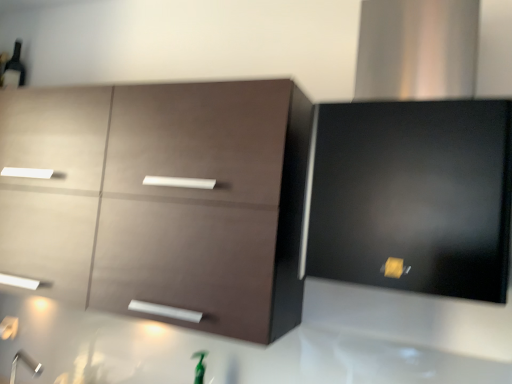
Question: Is satin black range hood at upper right, the 2th cabinetry in the left-to-right sequence, wider or thinner than matte black beer bottle at upper left?

Choices:
 (A) wide
 (B) thin

Answer: (A)

Question: In terms of height, does satin black range hood at upper right, which ranks as the 1th cabinetry in right-to-left order, look taller or shorter compared to matte black beer bottle at upper left?

Choices:
 (A) short
 (B) tall

Answer: (B)

Question: Estimate the real-world distances between objects in this image. Which object is farther from the matte black beer bottle at upper left?

Choices:
 (A) satin black range hood at upper right, the 2th cabinetry in the left-to-right sequence
 (B) matte brown cabinet at upper left, marked as the 2th cabinetry in a right-to-left arrangement

Answer: (A)

Question: Estimate the real-world distances between objects in this image. Which object is closer to the matte black beer bottle at upper left?

Choices:
 (A) matte brown cabinet at upper left, marked as the 2th cabinetry in a right-to-left arrangement
 (B) satin black range hood at upper right, which ranks as the 1th cabinetry in right-to-left order

Answer: (A)